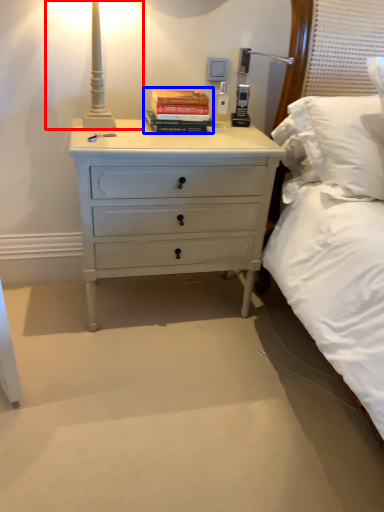
Question: Which object is closer to the camera taking this photo, bedside lamp (highlighted by a red box) or paperback book (highlighted by a blue box)?

Choices:
 (A) bedside lamp
 (B) paperback book

Answer: (A)